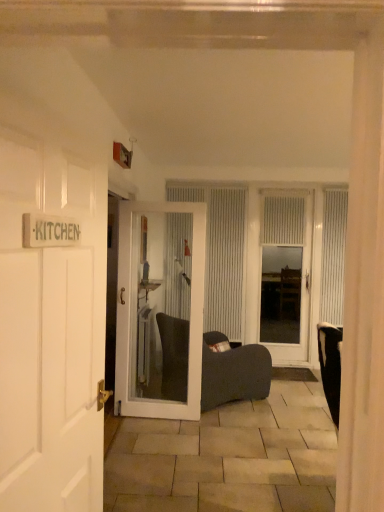
Locate an element on the screen. The width and height of the screenshot is (384, 512). vacant space in front of dark fabric chair at center is located at coordinates (215, 433).